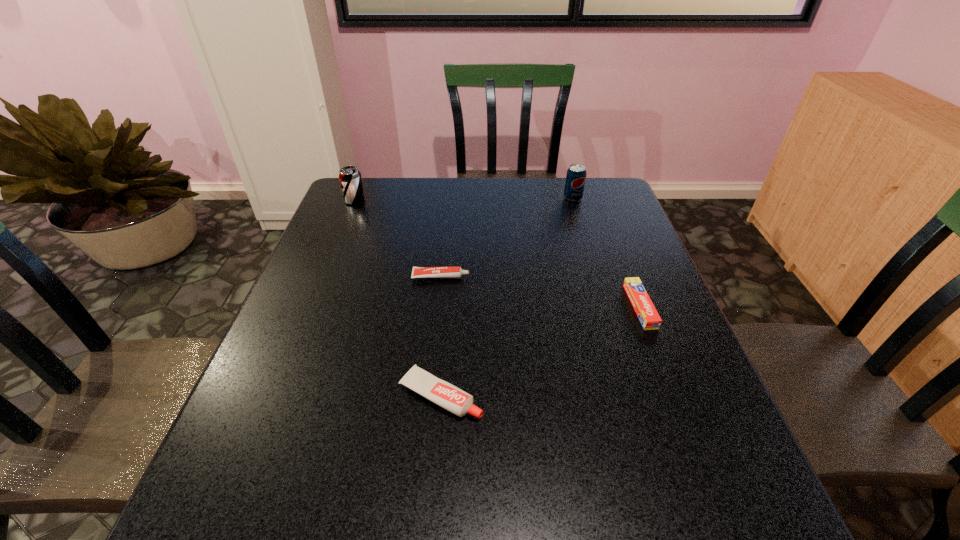
The image size is (960, 540). What are the coordinates of `free space between the third shortest object and the second nearest object` in the screenshot? It's located at (540, 351).

In order to click on free space between the leftmost object and the right soda can in this screenshot , I will do (x=464, y=199).

Image resolution: width=960 pixels, height=540 pixels. I want to click on vacant space in between the third shortest object and the farthest toothpaste, so click(441, 336).

Locate which object is the second closest to the third farthest object. Please provide its 2D coordinates. Your answer should be formatted as a tuple, i.e. [(x, y)], where the tuple contains the x and y coordinates of a point satisfying the conditions above.

[(350, 178)]

Select which object is the closest to the rightmost toothpaste. Please provide its 2D coordinates. Your answer should be formatted as a tuple, i.e. [(x, y)], where the tuple contains the x and y coordinates of a point satisfying the conditions above.

[(442, 393)]

Select which toothpaste appears as the second closest to the rightmost object. Please provide its 2D coordinates. Your answer should be formatted as a tuple, i.e. [(x, y)], where the tuple contains the x and y coordinates of a point satisfying the conditions above.

[(418, 272)]

Find the location of a particular element. The height and width of the screenshot is (540, 960). toothpaste that stands as the second closest to the rightmost object is located at coordinates (418, 272).

The image size is (960, 540). In order to click on vacant space that satisfies the following two spatial constraints: 1. on the front side of the right soda can; 2. at the nozzle of the third farthest object in this screenshot , I will do `click(597, 276)`.

Locate an element on the screen. vacant space that satisfies the following two spatial constraints: 1. at the nozzle of the third farthest object; 2. on the right side of the rightmost toothpaste is located at coordinates (438, 306).

You are a GUI agent. You are given a task and a screenshot of the screen. Output one action in this format:
    pyautogui.click(x=<x>, y=<y>)
    Task: Click on the free space that satisfies the following two spatial constraints: 1. on the front side of the second nearest toothpaste; 2. on the left side of the left soda can
    This screenshot has width=960, height=540.
    Given the screenshot: What is the action you would take?
    pyautogui.click(x=312, y=306)